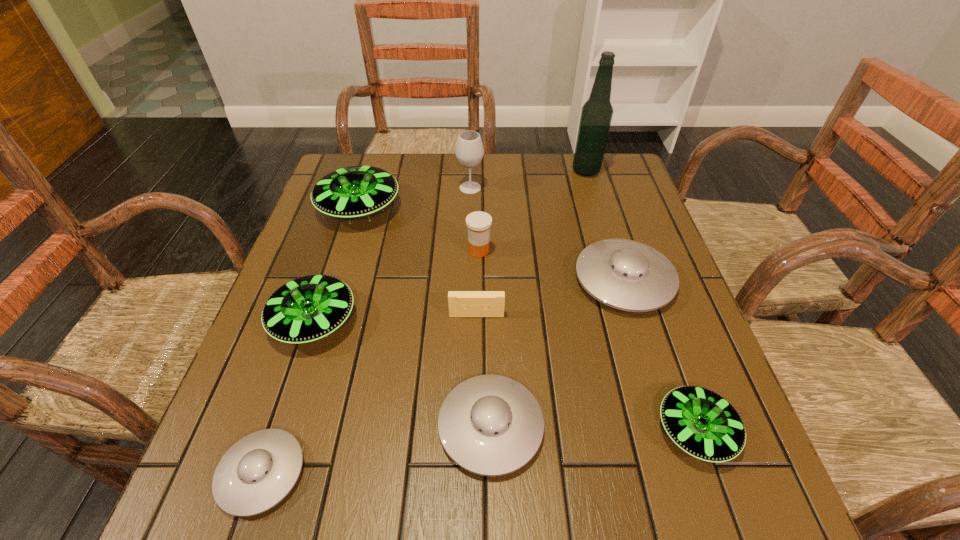
The height and width of the screenshot is (540, 960). What are the coordinates of `alcohol positioned at the right edge` in the screenshot? It's located at (596, 115).

Find the location of a particular element. The height and width of the screenshot is (540, 960). object located at the far left corner is located at coordinates (351, 192).

Locate an element on the screen. Image resolution: width=960 pixels, height=540 pixels. object located at the near left corner is located at coordinates (258, 471).

This screenshot has width=960, height=540. Find the location of `object that is at the far right corner`. object that is at the far right corner is located at coordinates pos(596,115).

Identify the location of object located in the near right corner section of the desktop. (702, 423).

This screenshot has height=540, width=960. What are the coordinates of `blank area at the far edge` in the screenshot? It's located at (493, 193).

Locate an element on the screen. This screenshot has width=960, height=540. vacant area at the near edge is located at coordinates (349, 475).

In the image, there is a desktop. At what (x,y) coordinates should I click in order to perform the action: click on vacant space at the left edge. Please return your answer as a coordinate pair (x, y). This screenshot has height=540, width=960. Looking at the image, I should click on (311, 347).

The height and width of the screenshot is (540, 960). In the image, there is a desktop. Identify the location of vacant space at the right edge. (592, 231).

Where is `blank region between the second smallest gray saucer and the medicine`? blank region between the second smallest gray saucer and the medicine is located at coordinates (485, 339).